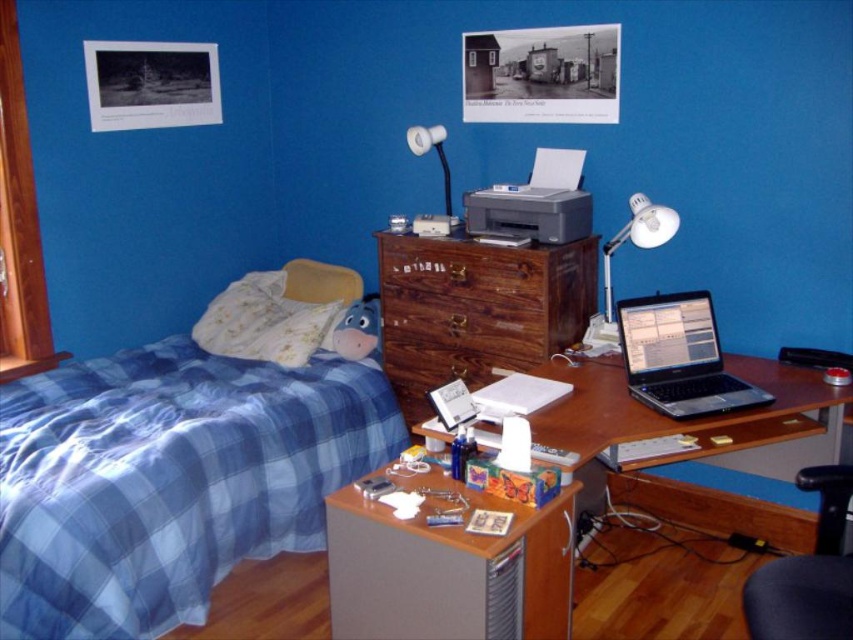
Based on the photo, does white plastic desk lamp at upper right lie behind matte plastic desk lamp at upper center?

No, it is not.

Who is lower down, white plastic desk lamp at upper right or matte plastic desk lamp at upper center?

Positioned lower is white plastic desk lamp at upper right.

The width and height of the screenshot is (853, 640). What do you see at coordinates (637, 236) in the screenshot?
I see `white plastic desk lamp at upper right` at bounding box center [637, 236].

Where is `white plastic desk lamp at upper right`? This screenshot has height=640, width=853. white plastic desk lamp at upper right is located at coordinates (637, 236).

Which is above, blue plaid fabric bed at left or matte plastic desk lamp at upper center?

matte plastic desk lamp at upper center is higher up.

Does point (200, 593) come closer to viewer compared to point (448, 186)?

Yes, point (200, 593) is in front of point (448, 186).

The image size is (853, 640). I want to click on blue plaid fabric bed at left, so click(x=170, y=481).

From the picture: Who is positioned more to the left, satin black laptop at center right or silver metallic printer at center?

silver metallic printer at center is more to the left.

Can you confirm if satin black laptop at center right is positioned below silver metallic printer at center?

Correct, satin black laptop at center right is located below silver metallic printer at center.

What do you see at coordinates (679, 356) in the screenshot?
I see `satin black laptop at center right` at bounding box center [679, 356].

Identify the location of satin black laptop at center right. This screenshot has width=853, height=640. (679, 356).